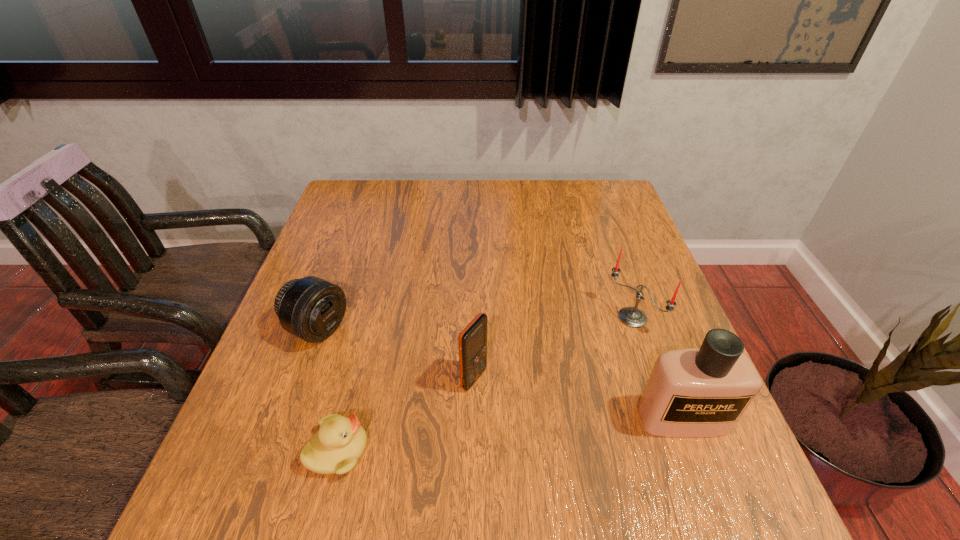
Image resolution: width=960 pixels, height=540 pixels. I want to click on perfume located in the right edge section of the desktop, so click(694, 392).

You are a GUI agent. You are given a task and a screenshot of the screen. Output one action in this format:
    pyautogui.click(x=<x>, y=<y>)
    Task: Click on the candle located at the right edge
    
    Given the screenshot: What is the action you would take?
    pyautogui.click(x=633, y=317)

Identify the location of object that is at the near left corner. The width and height of the screenshot is (960, 540). (335, 448).

Where is `object located in the near right corner section of the desktop`? Image resolution: width=960 pixels, height=540 pixels. object located in the near right corner section of the desktop is located at coordinates (694, 392).

The height and width of the screenshot is (540, 960). In the image, there is a desktop. What are the coordinates of `vacant space at the far edge` in the screenshot? It's located at (444, 211).

Locate an element on the screen. The image size is (960, 540). vacant space at the left edge of the desktop is located at coordinates (311, 383).

This screenshot has width=960, height=540. I want to click on vacant space at the right edge, so click(x=649, y=259).

In the image, there is a desktop. Identify the location of blank space at the far left corner. The height and width of the screenshot is (540, 960). (348, 180).

In the image, there is a desktop. At what (x,y) coordinates should I click in order to perform the action: click on vacant space at the far right corner. Please return your answer as a coordinate pair (x, y). This screenshot has width=960, height=540. Looking at the image, I should click on (624, 216).

In the image, there is a desktop. Where is `vacant space at the near right corner`? vacant space at the near right corner is located at coordinates (650, 456).